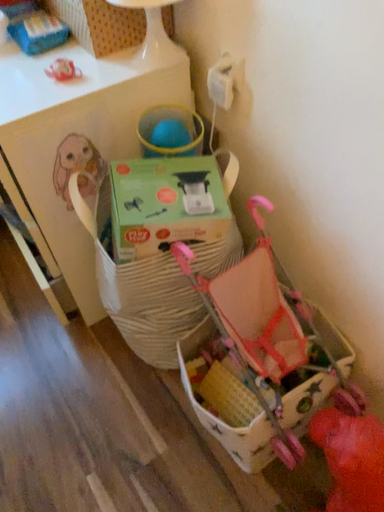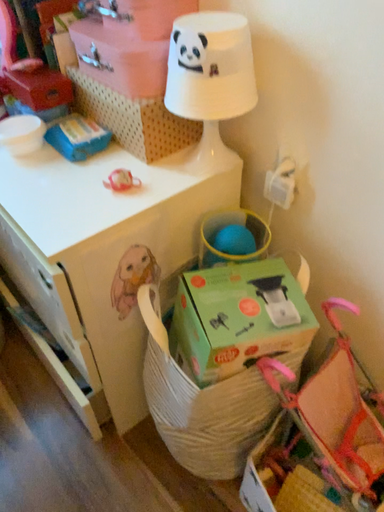
Question: How did the camera likely rotate when shooting the video?

Choices:
 (A) rotated downward
 (B) rotated upward

Answer: (B)